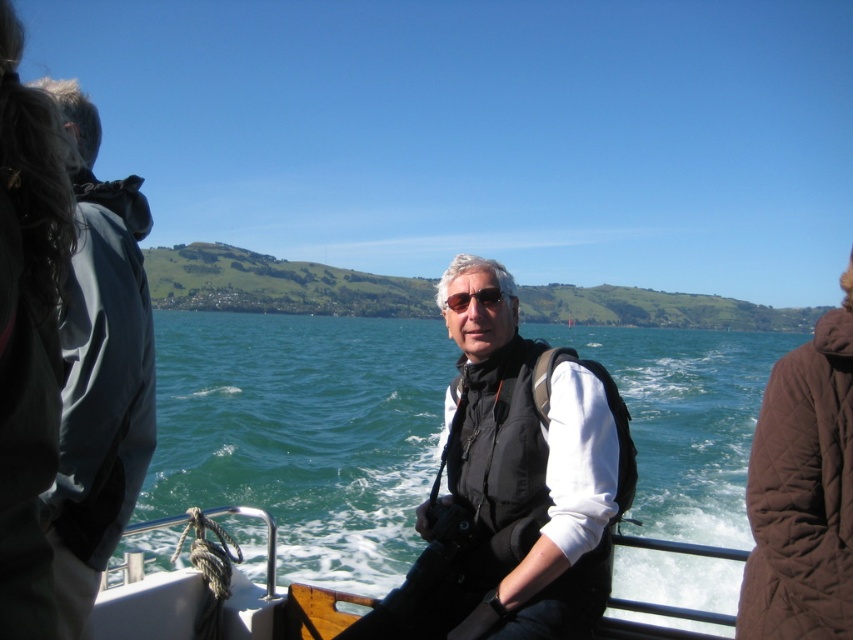
Question: Is the position of matte black vest at center less distant than that of dark gray jacket at left?

Choices:
 (A) no
 (B) yes

Answer: (A)

Question: Which object is closer to the camera taking this photo?

Choices:
 (A) green water at center
 (B) matte black sunglasses at center
 (C) brown quilted coat at right
 (D) dark brown hair at upper left

Answer: (D)

Question: Which point appears farthest from the camera in this image?

Choices:
 (A) (648, 604)
 (B) (61, 86)

Answer: (A)

Question: Among these objects, which one is farthest from the camera?

Choices:
 (A) white plastic boat at center
 (B) green water at center
 (C) brown quilted coat at right
 (D) dark gray jacket at left

Answer: (B)

Question: Does dark brown hair at upper left have a lesser width compared to matte black sunglasses at center?

Choices:
 (A) no
 (B) yes

Answer: (A)

Question: Does dark brown hair at upper left appear under white plastic boat at center?

Choices:
 (A) no
 (B) yes

Answer: (A)